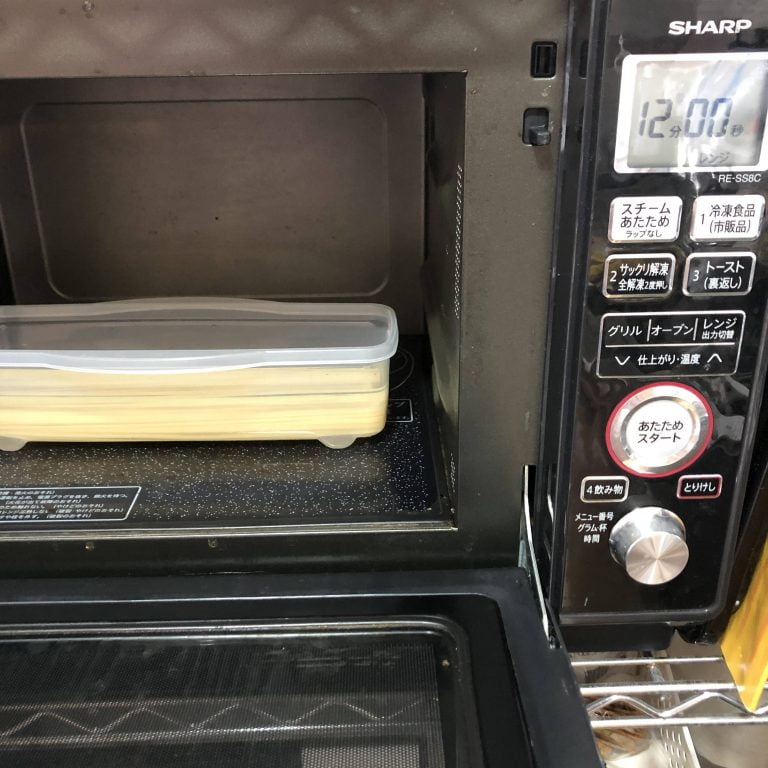
Find the location of `red circle outline of oven button`. red circle outline of oven button is located at coordinates pyautogui.click(x=607, y=425).